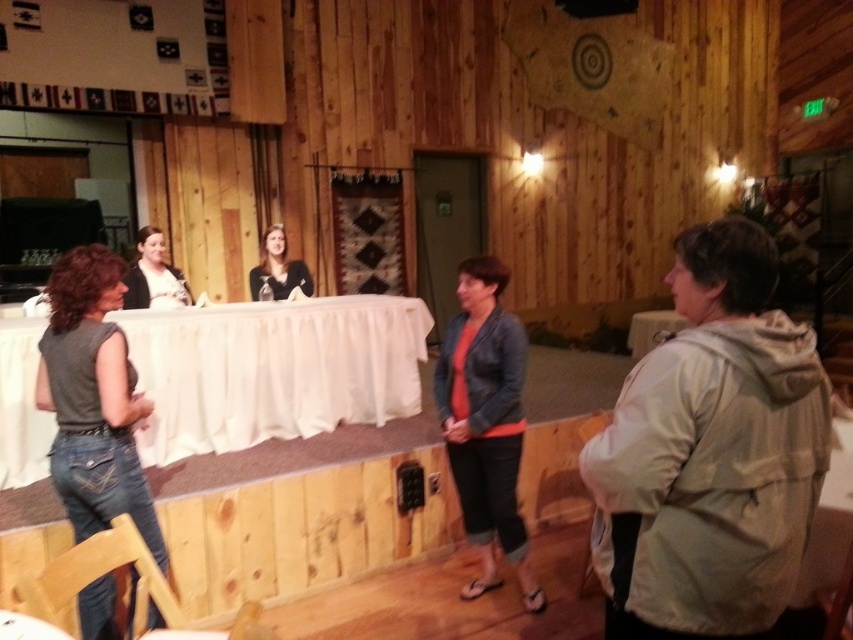
Question: Which point is closer to the camera taking this photo?

Choices:
 (A) (277, 234)
 (B) (158, 266)
 (C) (97, 634)

Answer: (C)

Question: Which of these objects is positioned closest to the matte black jacket at center?

Choices:
 (A) orange fabric jacket at center
 (B) white satin tablecloth at center

Answer: (B)

Question: Where is orange fabric jacket at center located in relation to matte black jacket at center in the image?

Choices:
 (A) left
 (B) right

Answer: (B)

Question: From the image, what is the correct spatial relationship of matte black jacket at center in relation to matte black shirt at center?

Choices:
 (A) above
 (B) below

Answer: (B)

Question: Which point appears closest to the camera in this image?

Choices:
 (A) (325, 380)
 (B) (280, 266)
 (C) (108, 499)
 (D) (467, 438)

Answer: (C)

Question: Does white satin tablecloth at center have a larger size compared to denim jeans at left?

Choices:
 (A) yes
 (B) no

Answer: (A)